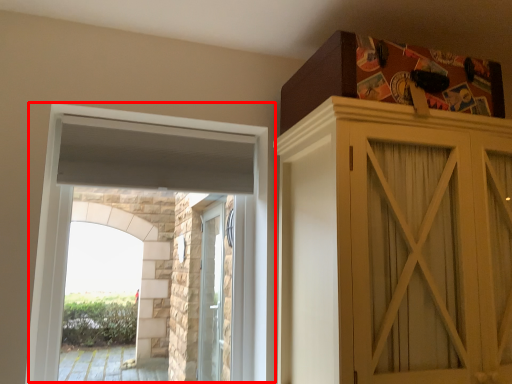
Question: From the image's perspective, what is the correct spatial relationship of window (annotated by the red box) in relation to cupboard?

Choices:
 (A) below
 (B) above

Answer: (B)